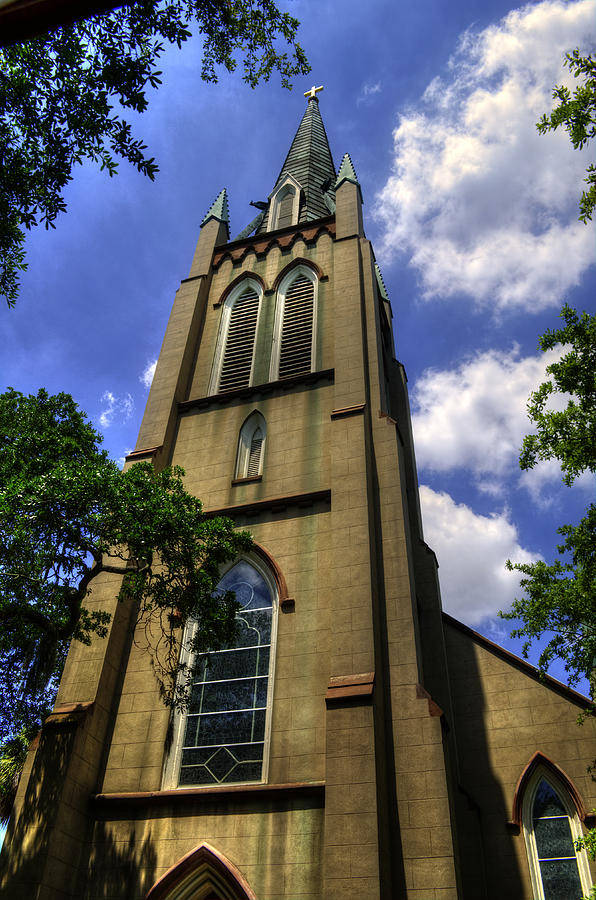
The height and width of the screenshot is (900, 596). In order to click on windows in this screenshot , I will do `click(232, 660)`, `click(558, 832)`, `click(254, 447)`, `click(238, 339)`, `click(294, 320)`.